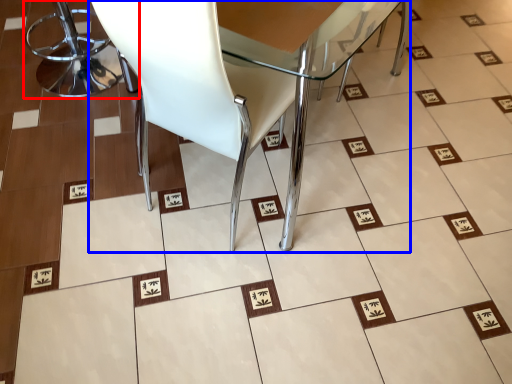
Question: Which point is further to the camera, chair (highlighted by a red box) or chair (highlighted by a blue box)?

Choices:
 (A) chair
 (B) chair

Answer: (A)